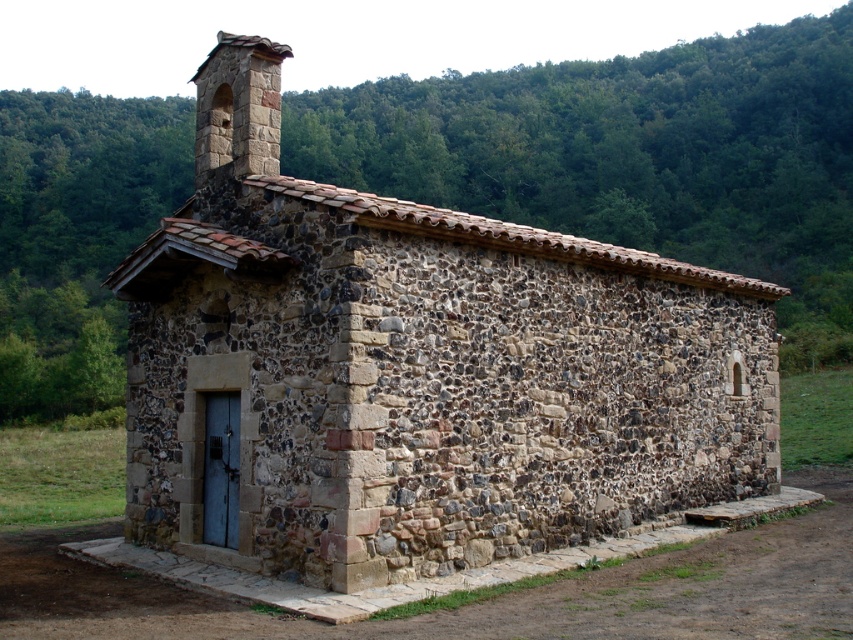
Between rustic stone church at center and rustic stone chimney at upper center, which one appears on the left side from the viewer's perspective?

rustic stone chimney at upper center is more to the left.

Which is above, rustic stone church at center or rustic stone chimney at upper center?

rustic stone chimney at upper center is higher up.

Find the location of a particular element. The width and height of the screenshot is (853, 640). rustic stone church at center is located at coordinates [424, 385].